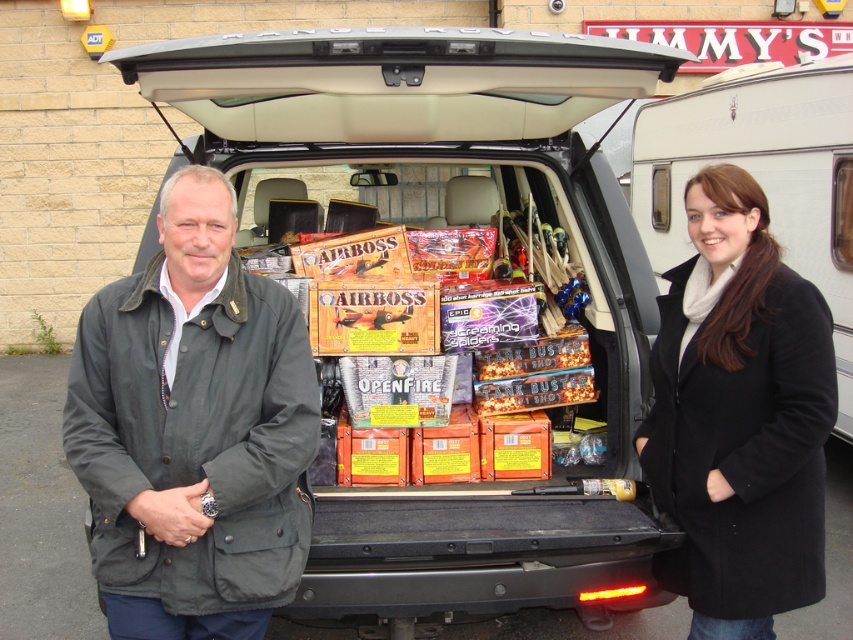
You are a photographer trying to capture both the dark green waxed fabric jacket at left and the black wool coat at lower right in the same frame. Based on their positions and sizes, which jacket might require you to zoom out slightly to ensure it fits in the photo?

The dark green waxed fabric jacket at left might be wider than the black wool coat at lower right, so you might need to zoom out slightly to include it in the frame.

You are a delivery person who needs to load a package into the trunk of the Range Rover. The trunk is already filled with fireworks boxes. You have a large box that needs to be placed either to the left of the dark green waxed fabric jacket at left or to the right of the white glossy caravan at upper right. Based on their positions, which side has more space for the box?

The dark green waxed fabric jacket at left is to the left of the white glossy caravan at upper right, so the space to the right of the white glossy caravan at upper right may have more space available for the large box since it is positioned further to the right in the trunk.